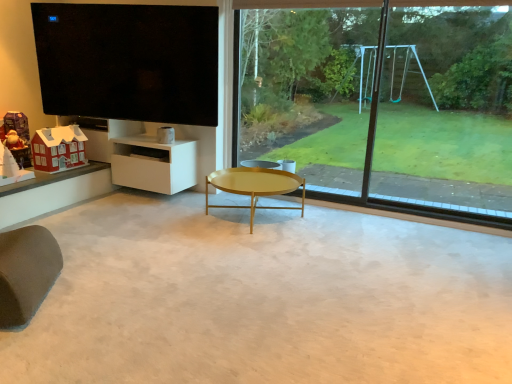
Question: Is brown fabric swivel chair at lower left not within black glossy tv at upper left?

Choices:
 (A) no
 (B) yes

Answer: (B)

Question: Is the depth of brown fabric swivel chair at lower left greater than that of black glossy tv at upper left?

Choices:
 (A) yes
 (B) no

Answer: (B)

Question: Is black glossy tv at upper left located within brown fabric swivel chair at lower left?

Choices:
 (A) no
 (B) yes

Answer: (A)

Question: From a real-world perspective, does brown fabric swivel chair at lower left sit lower than black glossy tv at upper left?

Choices:
 (A) yes
 (B) no

Answer: (A)

Question: Considering the relative positions of brown fabric swivel chair at lower left and black glossy tv at upper left in the image provided, is brown fabric swivel chair at lower left to the right of black glossy tv at upper left from the viewer's perspective?

Choices:
 (A) yes
 (B) no

Answer: (B)

Question: Is brown fabric swivel chair at lower left inside or outside of gold metallic coffee table at center?

Choices:
 (A) outside
 (B) inside

Answer: (A)

Question: Is point (17, 251) positioned closer to the camera than point (269, 178)?

Choices:
 (A) farther
 (B) closer

Answer: (B)

Question: In terms of size, does brown fabric swivel chair at lower left appear bigger or smaller than gold metallic coffee table at center?

Choices:
 (A) small
 (B) big

Answer: (A)

Question: In terms of height, does brown fabric swivel chair at lower left look taller or shorter compared to gold metallic coffee table at center?

Choices:
 (A) tall
 (B) short

Answer: (A)

Question: In the image, is gold metallic coffee table at center positioned in front of or behind matte red house at lower left, the 2th toy in the left-to-right sequence?

Choices:
 (A) front
 (B) behind

Answer: (A)

Question: Is gold metallic coffee table at center inside or outside of matte red house at lower left, marked as the first toy in a right-to-left arrangement?

Choices:
 (A) inside
 (B) outside

Answer: (B)

Question: In terms of width, does gold metallic coffee table at center look wider or thinner when compared to matte red house at lower left, the 2th toy in the left-to-right sequence?

Choices:
 (A) thin
 (B) wide

Answer: (B)

Question: In terms of height, does gold metallic coffee table at center look taller or shorter compared to matte red house at lower left, marked as the first toy in a right-to-left arrangement?

Choices:
 (A) tall
 (B) short

Answer: (B)

Question: Is gold metallic coffee table at center in front of or behind brown fabric swivel chair at lower left in the image?

Choices:
 (A) front
 (B) behind

Answer: (B)

Question: Is gold metallic coffee table at center spatially inside brown fabric swivel chair at lower left, or outside of it?

Choices:
 (A) inside
 (B) outside

Answer: (B)